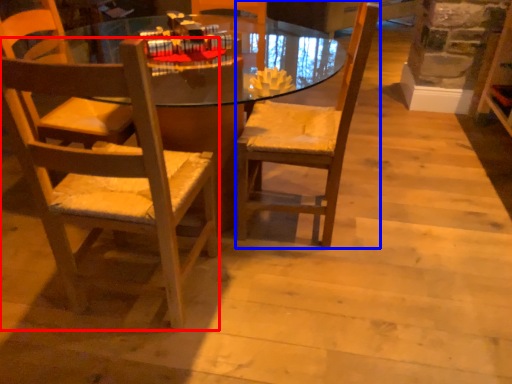
Question: Which object appears farthest to the camera in this image, chair (highlighted by a red box) or chair (highlighted by a blue box)?

Choices:
 (A) chair
 (B) chair

Answer: (B)